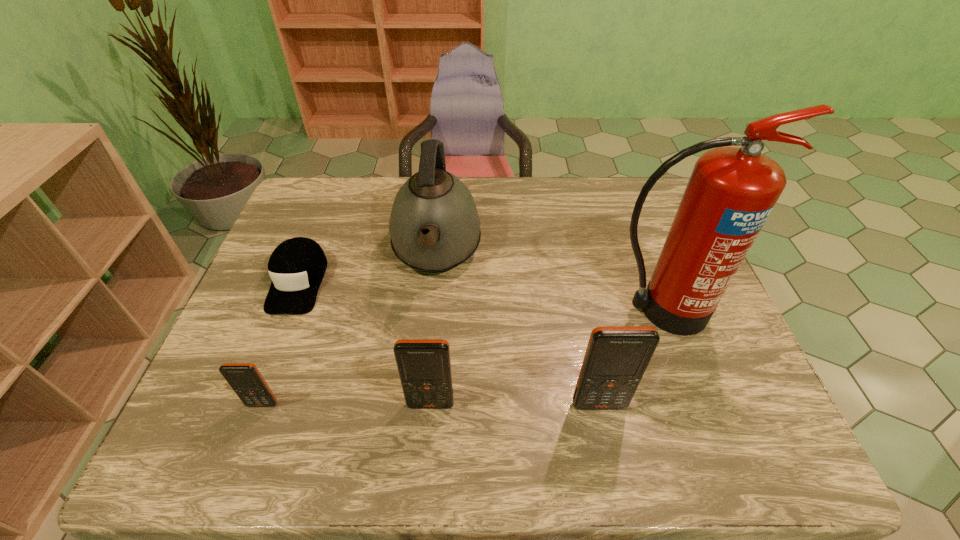
Where is `free location located on the front-facing side of the cap`? free location located on the front-facing side of the cap is located at coordinates (268, 360).

You are a GUI agent. You are given a task and a screenshot of the screen. Output one action in this format:
    pyautogui.click(x=<x>, y=<y>)
    Task: Click on the vacant space located 0.170m on the surface of the fire extinguisher
    The image size is (960, 540).
    Given the screenshot: What is the action you would take?
    pyautogui.click(x=693, y=400)

You are a GUI agent. You are given a task and a screenshot of the screen. Output one action in this format:
    pyautogui.click(x=<x>, y=<y>)
    Task: Click on the object that is at the far edge
    
    Given the screenshot: What is the action you would take?
    pyautogui.click(x=434, y=225)

What are the coordinates of `cellular telephone that is at the left edge` in the screenshot? It's located at (245, 379).

You are a GUI agent. You are given a task and a screenshot of the screen. Output one action in this format:
    pyautogui.click(x=<x>, y=<y>)
    Task: Click on the cap at the left edge
    
    Given the screenshot: What is the action you would take?
    pyautogui.click(x=297, y=266)

Locate an element on the screen. This screenshot has width=960, height=540. object at the right edge is located at coordinates (731, 192).

Image resolution: width=960 pixels, height=540 pixels. Find the location of `object located at the near left corner`. object located at the near left corner is located at coordinates (245, 379).

This screenshot has width=960, height=540. In the image, there is a desktop. Find the location of `vacant space at the far edge`. vacant space at the far edge is located at coordinates (377, 211).

Where is `free space at the near edge of the desktop`? Image resolution: width=960 pixels, height=540 pixels. free space at the near edge of the desktop is located at coordinates (573, 382).

The image size is (960, 540). What are the coordinates of `vacant space at the left edge of the desktop` in the screenshot? It's located at (259, 289).